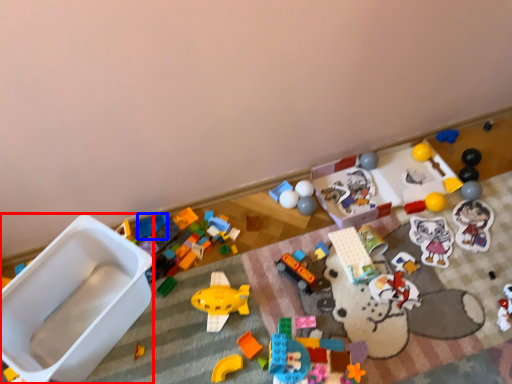
Question: Which object is further to the camera taking this photo, toy (highlighted by a red box) or toy (highlighted by a blue box)?

Choices:
 (A) toy
 (B) toy

Answer: (B)